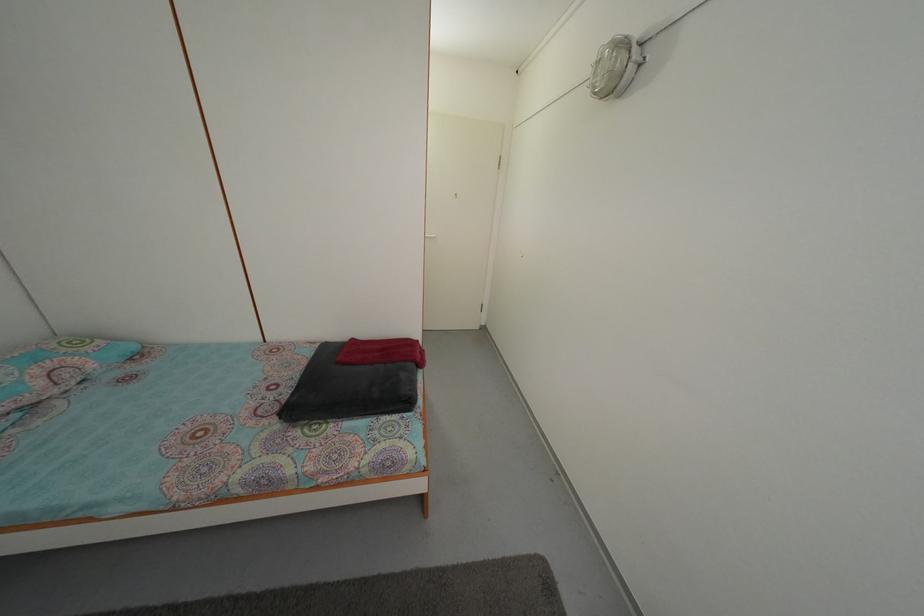
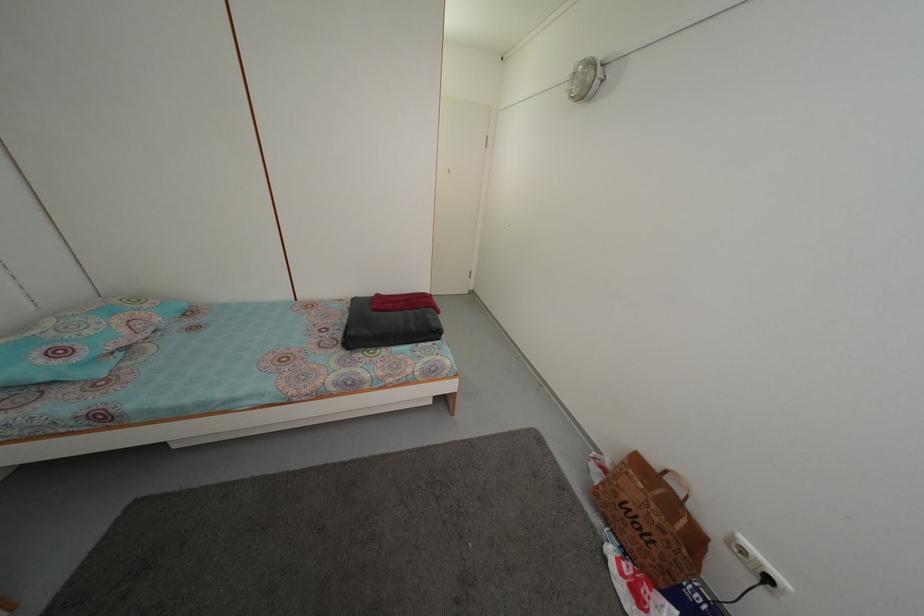
Find the pixel in the second image that matches point (378, 371) in the first image.

(407, 317)